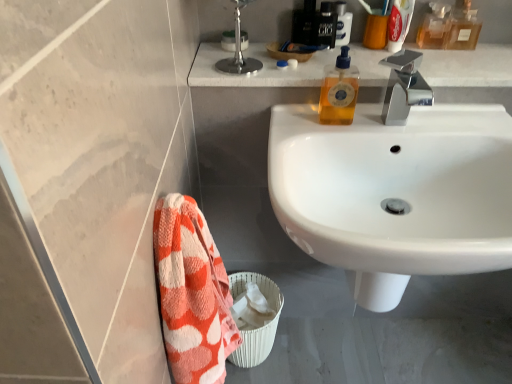
This screenshot has height=384, width=512. I want to click on free location in front of shiny black bottle at upper center, the second toiletry in the bottom-to-top sequence, so click(334, 64).